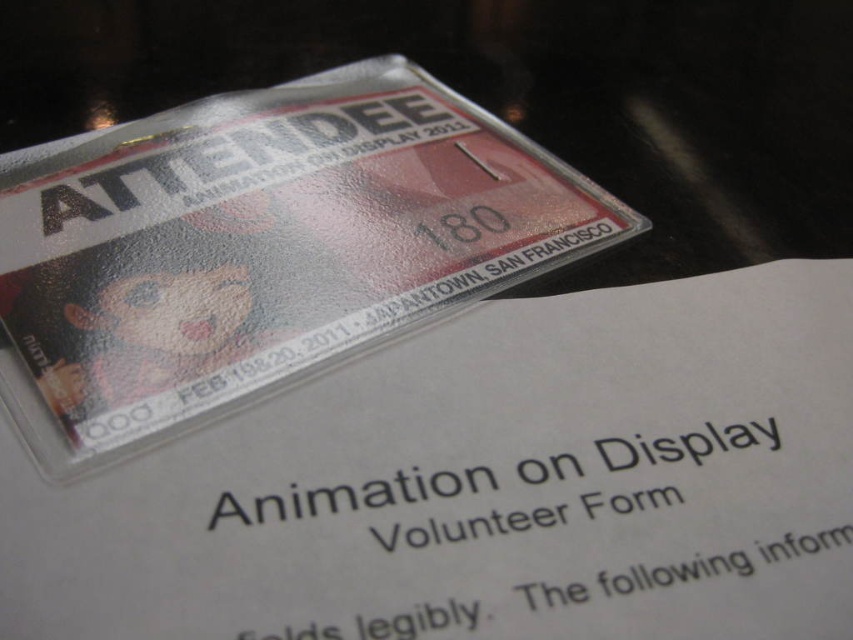
You are organizing a volunteer event and need to place both the white glossy paper at upper center and the glossy plastic badge at upper center into an envelope. The envelope can only fit one item at a time. Based on their positions in the image, which item should you pick first to ensure the volunteer form is visible when the envelope is opened?

The white glossy paper at upper center should be picked first because it is positioned on the right side of the glossy plastic badge at upper center, so placing it into the envelope first would allow the volunteer form to be visible when the envelope is opened.

You are organizing a volunteer event and need to check the volunteer form. You see the white glossy paper at upper center and the glossy plastic badge at upper center. Which one is closer to you?

The white glossy paper at upper center is in front of the glossy plastic badge at upper center, so it is closer to you.